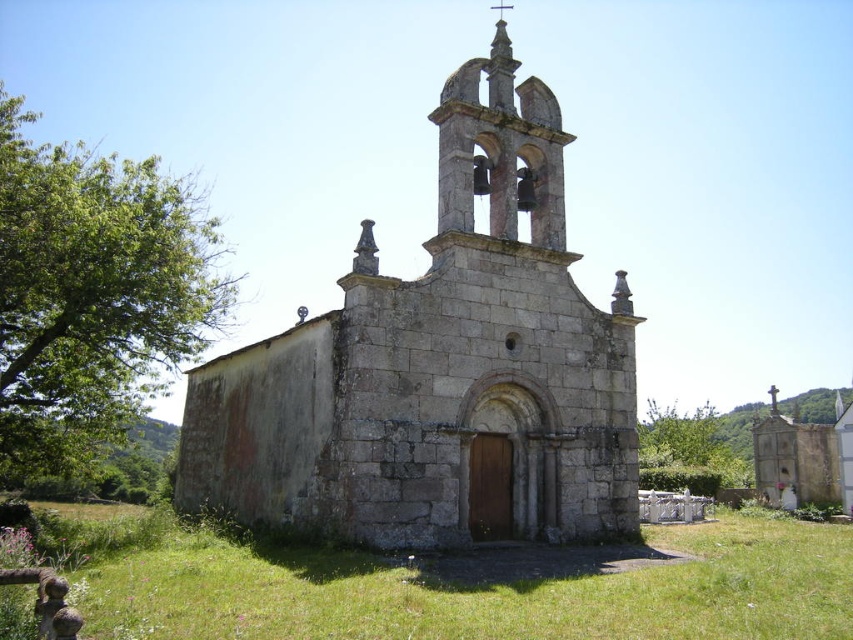
You are standing at the center of the image. Which direction should you move to get closer to the stone church at center?

Since the stone church at center is already at the center of the image, you don not need to move in any direction to get closer to it. You are already at the optimal position.